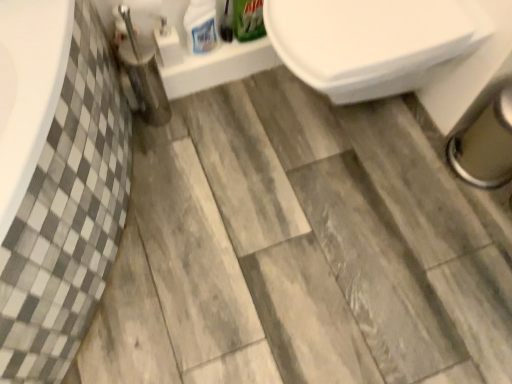
Question: Which direction should I rotate to face white glossy bottle at upper center, which is the 2th cleaning product from right to left, — up or down?

Choices:
 (A) up
 (B) down

Answer: (A)

Question: Can you confirm if green matte box at upper center, which is the 1th cleaning product in right-to-left order, is positioned to the right of white glossy bottle at upper center, placed as the first cleaning product when sorted from left to right?

Choices:
 (A) yes
 (B) no

Answer: (A)

Question: Is green matte box at upper center, which is the 1th cleaning product in right-to-left order, wider than white glossy bottle at upper center, placed as the first cleaning product when sorted from left to right?

Choices:
 (A) yes
 (B) no

Answer: (B)

Question: Does green matte box at upper center, acting as the second cleaning product starting from the left, have a lesser width compared to white glossy bottle at upper center, placed as the first cleaning product when sorted from left to right?

Choices:
 (A) no
 (B) yes

Answer: (B)

Question: Is green matte box at upper center, which is the 1th cleaning product in right-to-left order, directly adjacent to white glossy bottle at upper center, placed as the first cleaning product when sorted from left to right?

Choices:
 (A) no
 (B) yes

Answer: (A)

Question: Is the position of green matte box at upper center, acting as the second cleaning product starting from the left, less distant than that of white glossy bottle at upper center, placed as the first cleaning product when sorted from left to right?

Choices:
 (A) no
 (B) yes

Answer: (A)

Question: From the image's perspective, is green matte box at upper center, which is the 1th cleaning product in right-to-left order, below white glossy bottle at upper center, which is the 2th cleaning product from right to left?

Choices:
 (A) no
 (B) yes

Answer: (A)

Question: From a real-world perspective, is green matte box at upper center, acting as the second cleaning product starting from the left, positioned over brushed metal toilet brush at lower left based on gravity?

Choices:
 (A) no
 (B) yes

Answer: (B)

Question: From a real-world perspective, is green matte box at upper center, which is the 1th cleaning product in right-to-left order, positioned under brushed metal toilet brush at lower left based on gravity?

Choices:
 (A) no
 (B) yes

Answer: (A)

Question: Is green matte box at upper center, acting as the second cleaning product starting from the left, touching brushed metal toilet brush at lower left?

Choices:
 (A) yes
 (B) no

Answer: (B)

Question: Considering the relative sizes of green matte box at upper center, which is the 1th cleaning product in right-to-left order, and brushed metal toilet brush at lower left in the image provided, is green matte box at upper center, which is the 1th cleaning product in right-to-left order, wider than brushed metal toilet brush at lower left?

Choices:
 (A) yes
 (B) no

Answer: (B)

Question: Does green matte box at upper center, acting as the second cleaning product starting from the left, come in front of brushed metal toilet brush at lower left?

Choices:
 (A) no
 (B) yes

Answer: (A)

Question: Is green matte box at upper center, which is the 1th cleaning product in right-to-left order, aimed at brushed metal toilet brush at lower left?

Choices:
 (A) yes
 (B) no

Answer: (B)

Question: Can you confirm if brushed metal toilet brush at lower left is thinner than white glossy bottle at upper center, which is the 2th cleaning product from right to left?

Choices:
 (A) no
 (B) yes

Answer: (A)